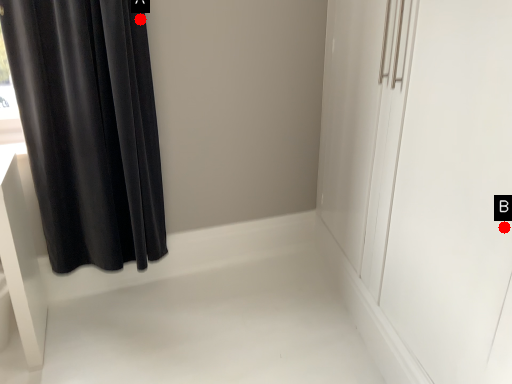
Question: Two points are circled on the image, labeled by A and B beside each circle. Which point appears closest to the camera in this image?

Choices:
 (A) A is closer
 (B) B is closer

Answer: (B)